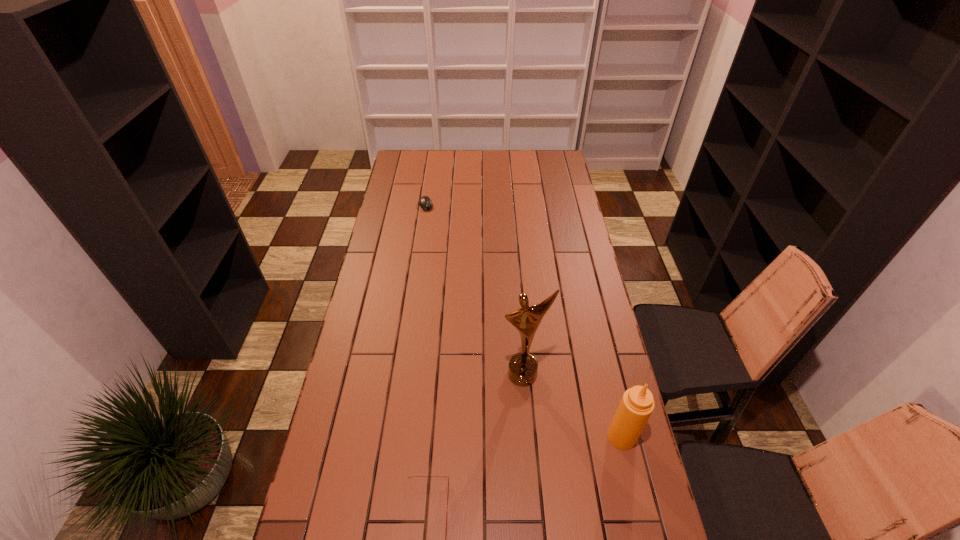
This screenshot has height=540, width=960. I want to click on condiment, so click(x=637, y=404).

You are a GUI agent. You are given a task and a screenshot of the screen. Output one action in this format:
    pyautogui.click(x=<x>, y=<y>)
    Task: Click on the rightmost object
    Image resolution: width=960 pixels, height=540 pixels.
    Given the screenshot: What is the action you would take?
    pyautogui.click(x=637, y=404)

Locate an element on the screen. This screenshot has width=960, height=540. the third nearest object is located at coordinates (522, 369).

Identify the location of the second object from right to left. The image size is (960, 540). (522, 369).

Find the location of a particular element. The image size is (960, 540). the farthest object is located at coordinates (425, 202).

In order to click on the shortest object in this screenshot , I will do `click(425, 202)`.

The height and width of the screenshot is (540, 960). Identify the location of vacant area situated 0.070m on the front of the condiment. (631, 475).

The width and height of the screenshot is (960, 540). In order to click on vacant space located 0.260m on the front-facing side of the tallest object in this screenshot , I will do `click(543, 469)`.

Image resolution: width=960 pixels, height=540 pixels. I want to click on vacant region located 0.350m on the front-facing side of the tallest object, so click(x=551, y=504).

Where is `vacant space located on the front-facing side of the tallest object`? The image size is (960, 540). vacant space located on the front-facing side of the tallest object is located at coordinates (546, 480).